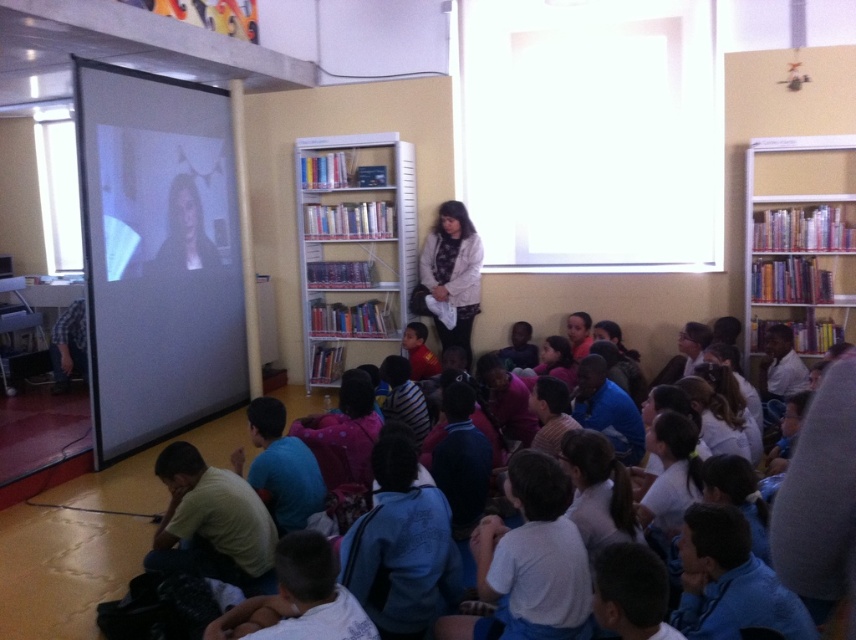
From the picture: You are a student sitting in the classroom and want to reach the white metal bookcase at center to get a book. However, there is a white plastic bookcase at upper right blocking your path. Can you walk around it to the left or right side?

The white metal bookcase at center is positioned on the left side of white plastic bookcase at upper right, so you can walk around to the left side of the white plastic bookcase at upper right to reach the white metal bookcase at center.

You are a student sitting in the classroom and you see both the white fabric at center and the matte red shirt at center. Which object is bigger?

The white fabric at center is larger in size than the matte red shirt at center.

Based on the photo, you are a student sitting at the back of the classroom. You want to see the projector screen clearly. Which object is blocking your view between the white metal bookcase at center and the white cotton shirt at lower center?

The white metal bookcase at center is located above the white cotton shirt at lower center. Since the bookcase is above the shirt, the white cotton shirt at lower center is closer to your eye level, so it might block your view more than the bookcase.